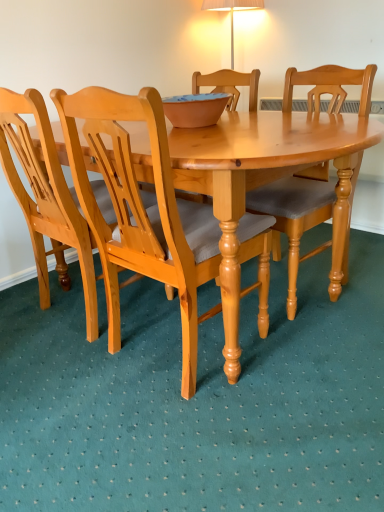
At what (x,y) coordinates should I click in order to perform the action: click on vacant space in front of light brown wood chair at center, the second chair in the left-to-right sequence. Please return your answer as a coordinate pair (x, y). The image size is (384, 512). Looking at the image, I should click on (207, 457).